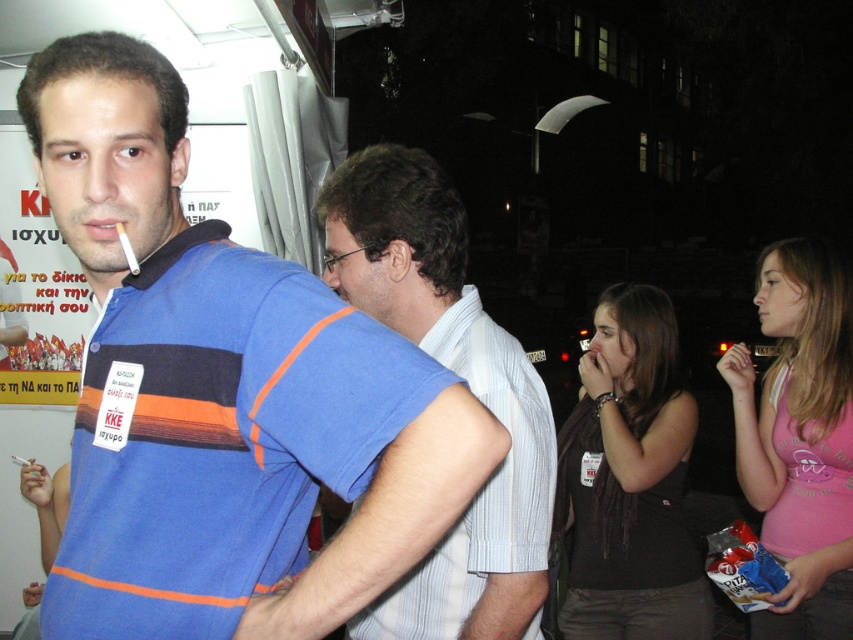
Can you confirm if dark brown fabric tank top at center is wider than pink cotton tank top at lower right?

Correct, the width of dark brown fabric tank top at center exceeds that of pink cotton tank top at lower right.

Between point (662, 348) and point (759, 410), which one is positioned behind?

The point (759, 410) is behind.

Where is `dark brown fabric tank top at center`? The width and height of the screenshot is (853, 640). dark brown fabric tank top at center is located at coordinates click(x=630, y=481).

Is blue striped polo shirt at center shorter than pink cotton tank top at lower right?

Yes, blue striped polo shirt at center is shorter than pink cotton tank top at lower right.

Image resolution: width=853 pixels, height=640 pixels. Describe the element at coordinates (222, 392) in the screenshot. I see `blue striped polo shirt at center` at that location.

Which is in front, point (109, 481) or point (775, 333)?

Point (109, 481)

This screenshot has height=640, width=853. Find the location of `blue striped polo shirt at center`. blue striped polo shirt at center is located at coordinates (222, 392).

Who is more distant from viewer, (485,492) or (851,436)?

The point (851,436) is behind.

Which is above, striped cotton shirt at center or pink cotton tank top at lower right?

striped cotton shirt at center is above.

What are the coordinates of `striped cotton shirt at center` in the screenshot? It's located at [460, 376].

What are the coordinates of `striped cotton shirt at center` in the screenshot? It's located at (460, 376).